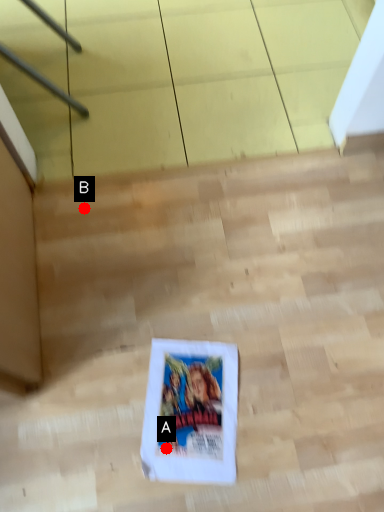
Question: Two points are circled on the image, labeled by A and B beside each circle. Which point is further to the camera?

Choices:
 (A) A is further
 (B) B is further

Answer: (B)